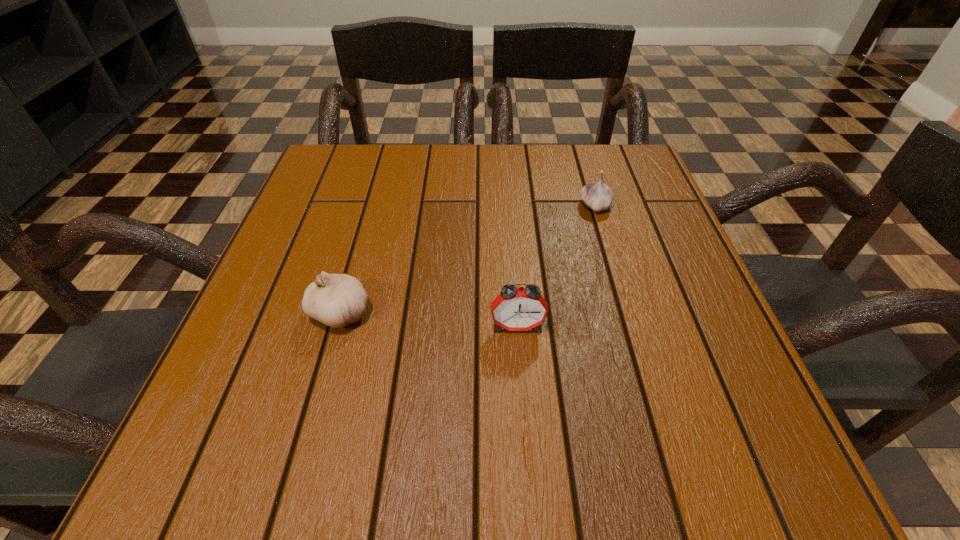
Image resolution: width=960 pixels, height=540 pixels. In order to click on alarm clock in this screenshot , I will do tap(515, 309).

At what (x,y) coordinates should I click in order to perform the action: click on the left garlic. Please return your answer as a coordinate pair (x, y). This screenshot has height=540, width=960. Looking at the image, I should click on (336, 300).

Identify the location of the leftmost object. Image resolution: width=960 pixels, height=540 pixels. [x=336, y=300].

Find the location of a particular element. This screenshot has height=540, width=960. the right garlic is located at coordinates (598, 196).

The width and height of the screenshot is (960, 540). What are the coordinates of `the farthest object` in the screenshot? It's located at (598, 196).

Identify the location of free space located on the clock face of the second object from left to right. The image size is (960, 540). coord(526,441).

Where is `blank space located 0.090m on the back of the leftmost object`? The height and width of the screenshot is (540, 960). blank space located 0.090m on the back of the leftmost object is located at coordinates (357, 255).

The image size is (960, 540). In order to click on vacant area situated on the front of the rightmost object in this screenshot , I will do `click(645, 372)`.

This screenshot has width=960, height=540. I want to click on object present at the far edge, so click(598, 196).

You are a GUI agent. You are given a task and a screenshot of the screen. Output one action in this format:
    pyautogui.click(x=<x>, y=<y>)
    Task: Click on the object that is at the left edge
    The image size is (960, 540).
    Given the screenshot: What is the action you would take?
    coord(336,300)